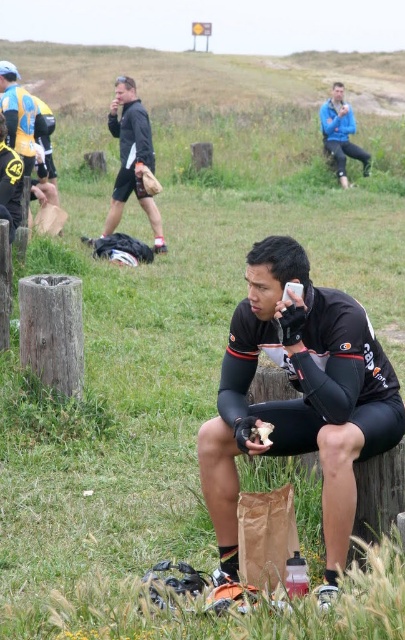
Based on the coordinates provided, which object is located at point (298, 397) in the image?

The point (298, 397) corresponds to the black matte shorts at center.

You are standing in the field and want to find the black matte jacket at left. Which direction should you look relative to the black matte shorts at center?

The black matte shorts at center is to the right of the black matte jacket at left, so you should look to the left of the black matte shorts at center to find the black matte jacket at left.